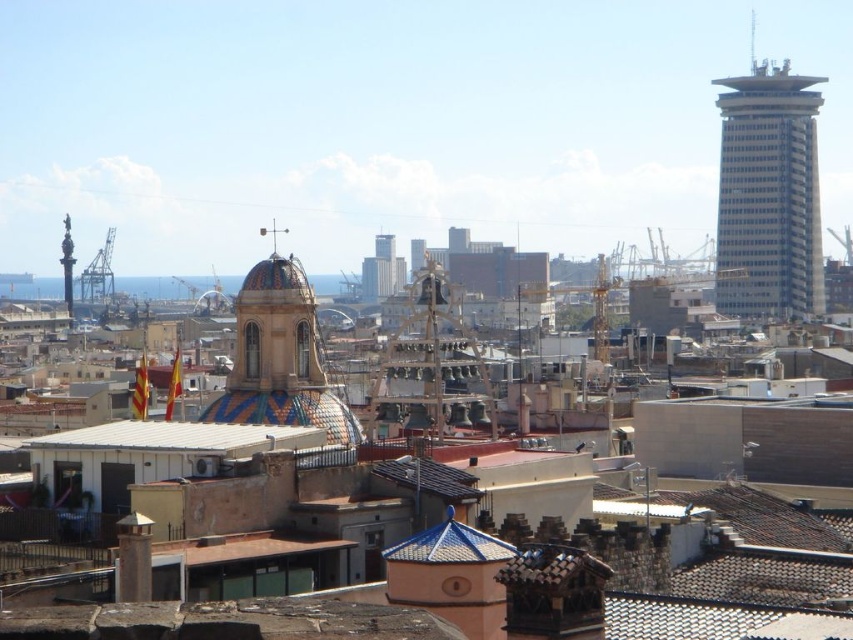
Is the position of smooth glass skyscraper at right less distant than that of white matte roof at center?

No, smooth glass skyscraper at right is further to the viewer.

Who is more distant from viewer, (721, 124) or (260, 442)?

Positioned behind is point (721, 124).

Find the location of a particular element. The width and height of the screenshot is (853, 640). smooth glass skyscraper at right is located at coordinates (769, 195).

From the picture: Does white matte roof at center have a greater height compared to blue glazed tiles at center?

Incorrect, white matte roof at center's height is not larger of blue glazed tiles at center's.

Can you confirm if white matte roof at center is positioned above blue glazed tiles at center?

Indeed, white matte roof at center is positioned over blue glazed tiles at center.

Who is more forward, (192, 435) or (450, 547)?

Point (450, 547)

Locate an element on the screen. Image resolution: width=853 pixels, height=640 pixels. white matte roof at center is located at coordinates (183, 436).

Can you confirm if smooth glass skyscraper at right is positioned above matte glass skyscraper at center?

Correct, smooth glass skyscraper at right is located above matte glass skyscraper at center.

Does smooth glass skyscraper at right have a greater width compared to matte glass skyscraper at center?

Correct, the width of smooth glass skyscraper at right exceeds that of matte glass skyscraper at center.

Who is more distant from viewer, (717, 305) or (410, 268)?

Point (410, 268)

Image resolution: width=853 pixels, height=640 pixels. Find the location of `smooth glass skyscraper at right`. smooth glass skyscraper at right is located at coordinates (769, 195).